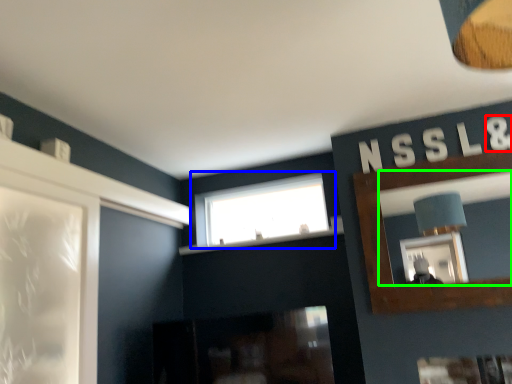
Question: Based on their relative distances, which object is farther from letter (highlighted by a red box)? Choose from window (highlighted by a blue box) and mirror (highlighted by a green box).

Choices:
 (A) window
 (B) mirror

Answer: (B)